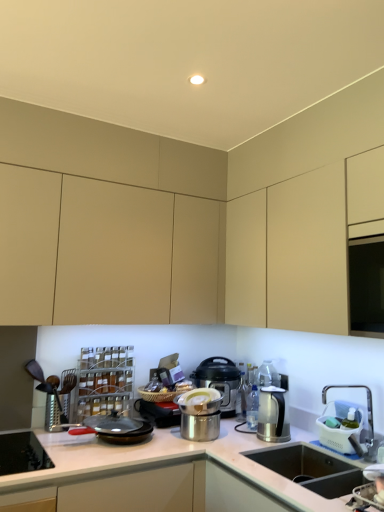
Question: In the image, is white glossy countertop at center positioned in front of or behind satin silver kettle at right, which is the 2th kitchen appliance in front-to-back order?

Choices:
 (A) behind
 (B) front

Answer: (B)

Question: In terms of size, does white glossy countertop at center appear bigger or smaller than satin silver kettle at right, which is the 2th kitchen appliance in front-to-back order?

Choices:
 (A) big
 (B) small

Answer: (A)

Question: Based on their relative distances, which object is farther from the matte black pressure cooker at center, which is counted as the 3th kitchen appliance, starting from the front?

Choices:
 (A) white glossy countertop at center
 (B) brushed metal grater at left
 (C) matte beige cabinet at center, acting as the 2th cabinetry starting from the back
 (D) black non-stick frying pan at center
 (E) matte beige cabinet at upper center, which is counted as the first cabinetry, starting from the back

Answer: (C)

Question: Which of these objects is positioned farthest from the brushed metal grater at left?

Choices:
 (A) brushed metal stove at lower left
 (B) white glossy countertop at center
 (C) satin silver kettle at right, which is the 2th kitchen appliance in front-to-back order
 (D) polished stainless steel pot at center, the third kitchen appliance viewed from the back
 (E) black non-stick frying pan at center

Answer: (C)